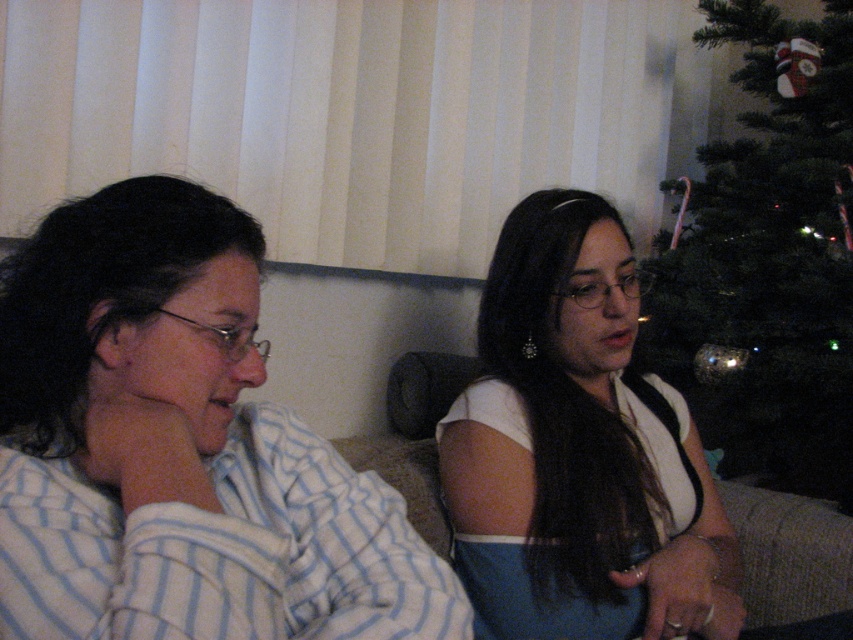
You are standing in the living room and want to hand a book to both the person wearing the white striped pajamas at left and the person wearing the white fabric dress at center. Which person should you approach first to ensure you can reach them without moving further into the room?

You should approach the person wearing the white striped pajamas at left first because they are closer to you than the white fabric dress at center, so you can reach them without moving further into the room.

You are a guest in the living room and want to hang a small ornament on the green matte christmas tree at right. The ornament is 10 cm tall. Can you determine if the white fabric dress at center will block your access to the top of the tree?

The white fabric dress at center is not as tall as the green matte christmas tree at right, so it may not block the top of the tree. However, since the dress is at center and the tree is at right, their positions might affect accessibility. Check the distance between them to ensure clear access.